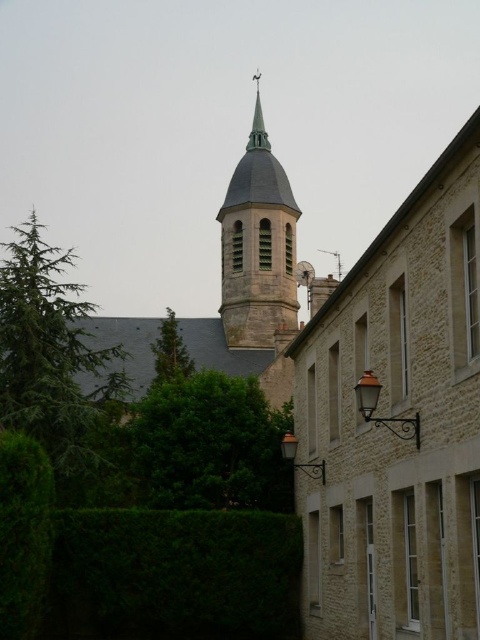
Between dark green hedge at lower center and green textured tree at center, which one is positioned higher?

green textured tree at center

Who is shorter, dark green hedge at lower center or green textured tree at center?

green textured tree at center

Where is `dark green hedge at lower center`? dark green hedge at lower center is located at coordinates (177, 573).

Where is `dark green hedge at lower center`? This screenshot has width=480, height=640. dark green hedge at lower center is located at coordinates (177, 573).

Which is more to the left, dark green hedge at lower center or green leafy hedge at lower left?

green leafy hedge at lower left

Who is more forward, (x=272, y=582) or (x=13, y=600)?

Point (x=13, y=600) is in front.

Where is `dark green hedge at lower center`? The image size is (480, 640). dark green hedge at lower center is located at coordinates coord(177,573).

Between point (430, 396) and point (252, 145), which one is positioned behind?

The point (252, 145) is more distant.

Can you confirm if smooth gray steeple at upper left is positioned to the right of smooth copper spire at upper center?

Indeed, smooth gray steeple at upper left is positioned on the right side of smooth copper spire at upper center.

Locate an element on the screen. The height and width of the screenshot is (640, 480). smooth gray steeple at upper left is located at coordinates (397, 424).